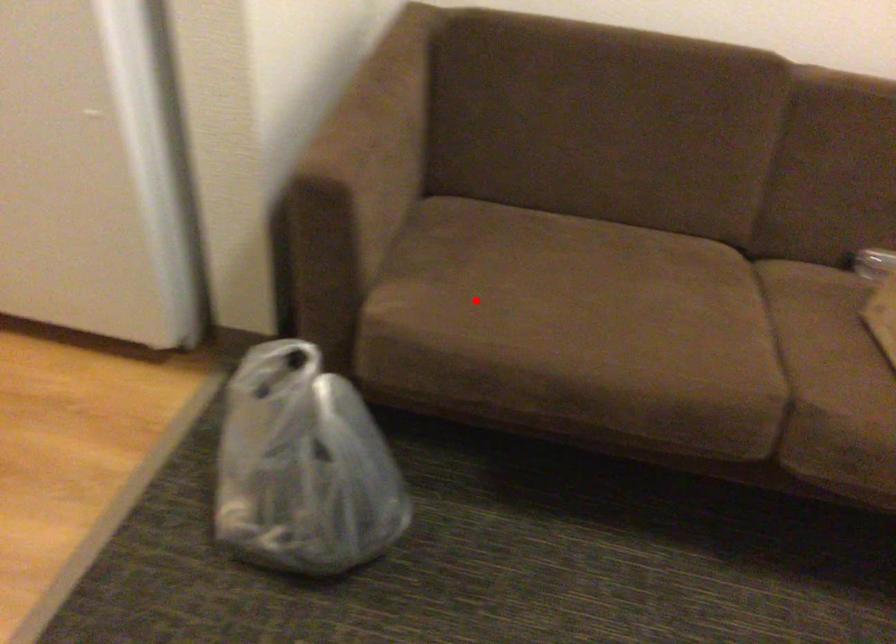
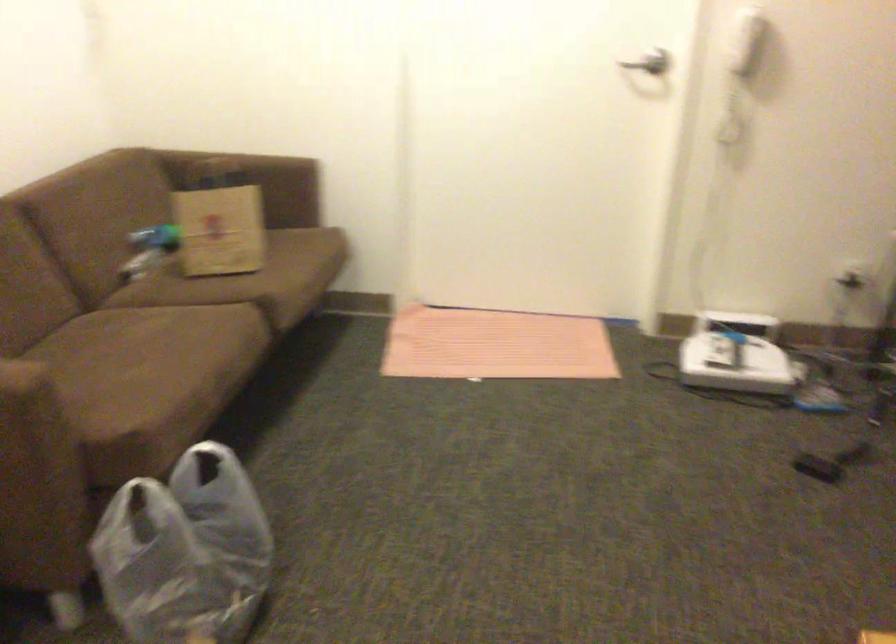
Where in the second image is the point corresponding to the highlighted location from the first image?

(110, 402)